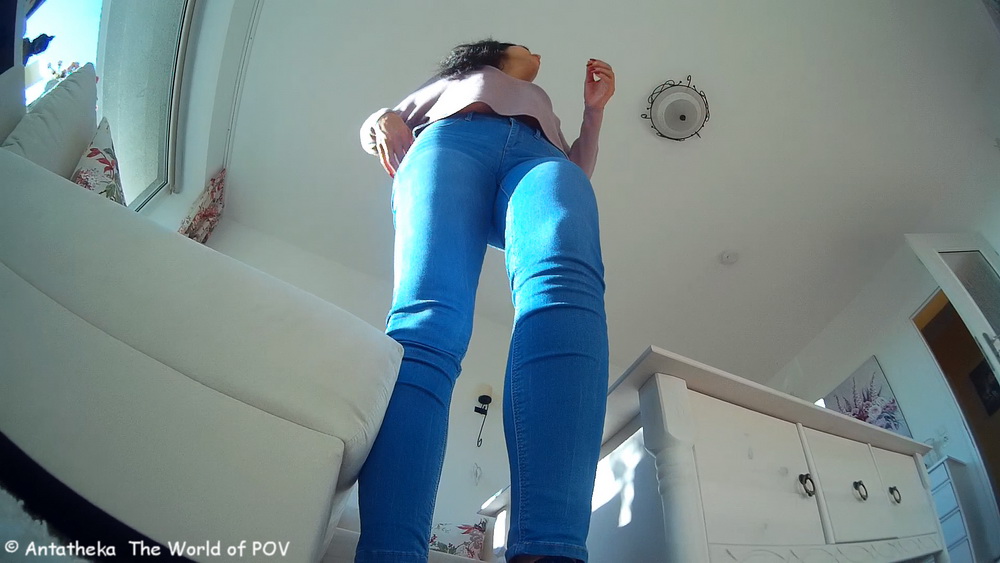
This screenshot has width=1000, height=563. I want to click on window, so click(x=110, y=48).